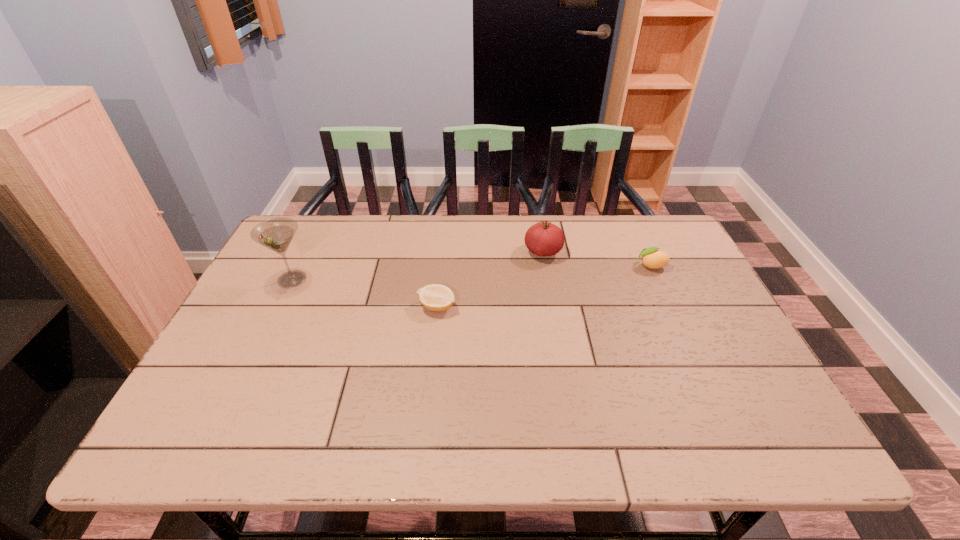
This screenshot has height=540, width=960. In the image, there is a desktop. What are the coordinates of `free space at the near edge` in the screenshot? It's located at (311, 436).

This screenshot has height=540, width=960. Identify the location of free spot at the left edge of the desktop. (265, 303).

I want to click on vacant space at the right edge, so click(715, 393).

Find the location of a particular element. The width and height of the screenshot is (960, 540). vacant space at the far right corner of the desktop is located at coordinates (667, 233).

In the image, there is a desktop. Where is `free space at the near right corner`? This screenshot has width=960, height=540. free space at the near right corner is located at coordinates (786, 423).

Where is `vacant area that lies between the leftmost object and the right lemon`? This screenshot has width=960, height=540. vacant area that lies between the leftmost object and the right lemon is located at coordinates (471, 273).

Identify the location of empty space that is in between the nearest object and the leftmost object. Image resolution: width=960 pixels, height=540 pixels. (365, 293).

Locate an element on the screen. free spot between the right lemon and the second tallest object is located at coordinates (597, 259).

What are the coordinates of `vacant area that lies between the tallest object and the shortest object` in the screenshot? It's located at click(365, 293).

What are the coordinates of `free spot between the leftmost object and the shorter lemon` in the screenshot? It's located at (365, 293).